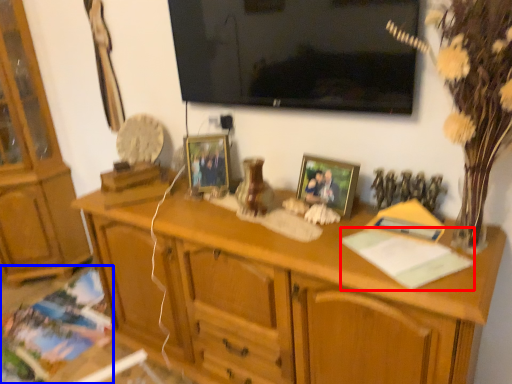
Question: Among these objects, which one is nearest to the camera, book (highlighted by a red box) or book (highlighted by a blue box)?

Choices:
 (A) book
 (B) book

Answer: (A)